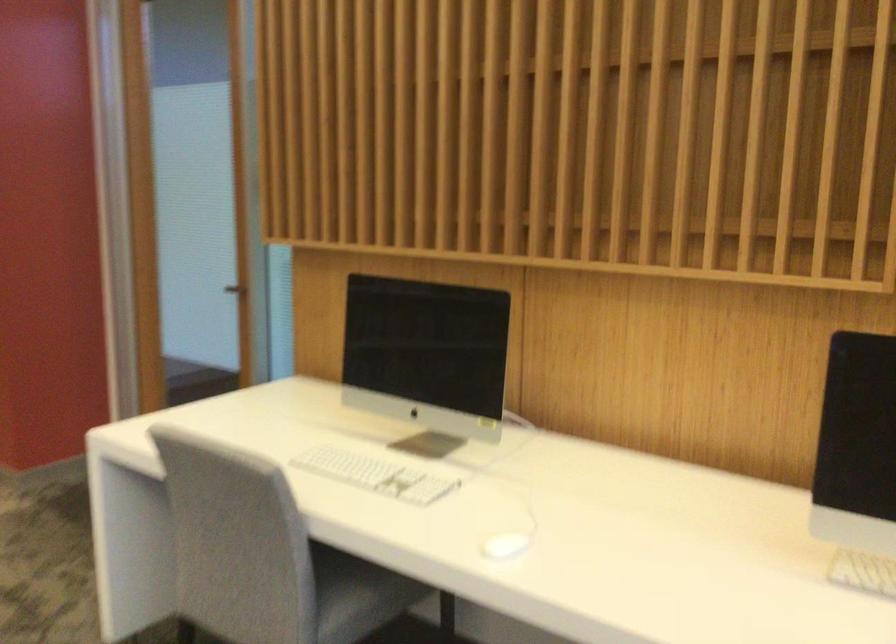
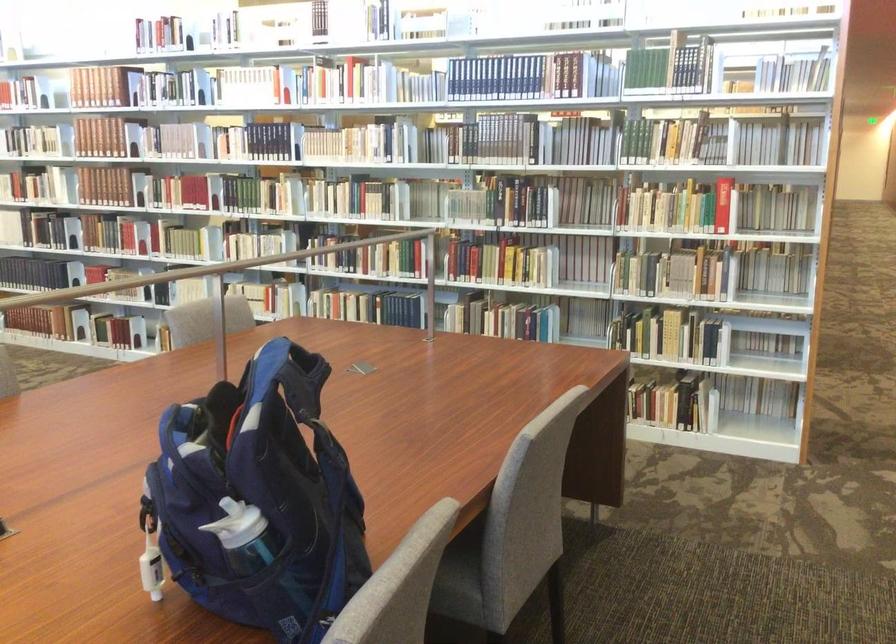
Question: The camera is either moving clockwise (left) or counter-clockwise (right) around the object. The first image is from the beginning of the video and the second image is from the end. Is the camera moving left or right when shooting the video?

Choices:
 (A) Left
 (B) Right

Answer: (B)